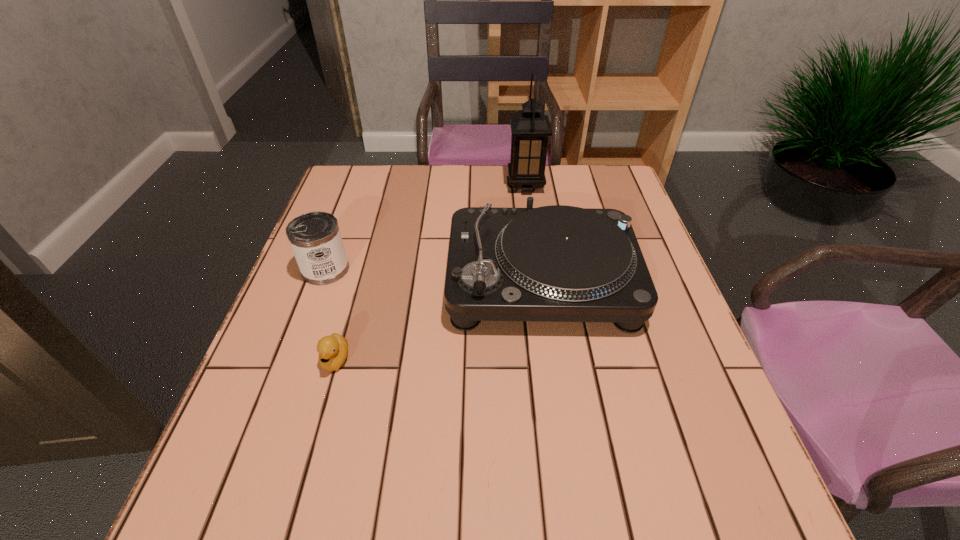
Select which object is the second closest to the duckling. Please provide its 2D coordinates. Your answer should be formatted as a tuple, i.e. [(x, y)], where the tuple contains the x and y coordinates of a point satisfying the conditions above.

[(557, 263)]

In order to click on free point that satisfies the following two spatial constraints: 1. on the front side of the record player; 2. on the left side of the lantern in this screenshot , I will do `click(539, 281)`.